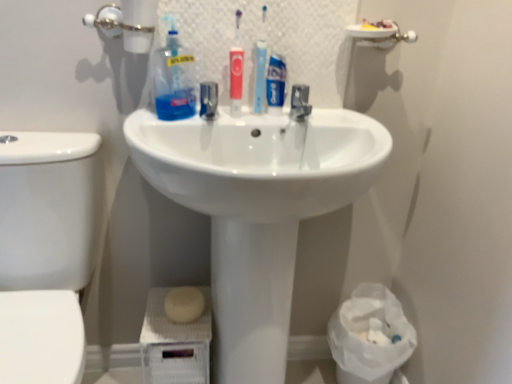
Question: From the image's perspective, is transparent plastic toothbrushes at upper center located beneath matte red toothbrush at center?

Choices:
 (A) no
 (B) yes

Answer: (A)

Question: From the image's perspective, does transparent plastic toothbrushes at upper center appear higher than matte red toothbrush at center?

Choices:
 (A) yes
 (B) no

Answer: (A)

Question: Considering the relative sizes of transparent plastic toothbrushes at upper center and matte red toothbrush at center in the image provided, is transparent plastic toothbrushes at upper center thinner than matte red toothbrush at center?

Choices:
 (A) no
 (B) yes

Answer: (B)

Question: Is transparent plastic toothbrushes at upper center oriented away from matte red toothbrush at center?

Choices:
 (A) yes
 (B) no

Answer: (A)

Question: Considering the relative sizes of transparent plastic toothbrushes at upper center and matte red toothbrush at center in the image provided, is transparent plastic toothbrushes at upper center taller than matte red toothbrush at center?

Choices:
 (A) no
 (B) yes

Answer: (B)

Question: Is transparent plastic toothbrushes at upper center closer to camera compared to matte red toothbrush at center?

Choices:
 (A) yes
 (B) no

Answer: (A)

Question: From a real-world perspective, is transparent plastic toothbrushes at upper center on white glossy sink at center?

Choices:
 (A) yes
 (B) no

Answer: (A)

Question: Could you tell me if transparent plastic toothbrushes at upper center is turned towards white glossy sink at center?

Choices:
 (A) yes
 (B) no

Answer: (B)

Question: Can you confirm if transparent plastic toothbrushes at upper center is wider than white glossy sink at center?

Choices:
 (A) no
 (B) yes

Answer: (A)

Question: Can you confirm if transparent plastic toothbrushes at upper center is smaller than white glossy sink at center?

Choices:
 (A) no
 (B) yes

Answer: (B)

Question: Are transparent plastic toothbrushes at upper center and white glossy sink at center far apart?

Choices:
 (A) yes
 (B) no

Answer: (B)

Question: Does transparent plastic toothbrushes at upper center have a larger size compared to white glossy sink at center?

Choices:
 (A) yes
 (B) no

Answer: (B)

Question: From a real-world perspective, is metallic faucet at center located beneath white plastic bag at lower right?

Choices:
 (A) no
 (B) yes

Answer: (A)